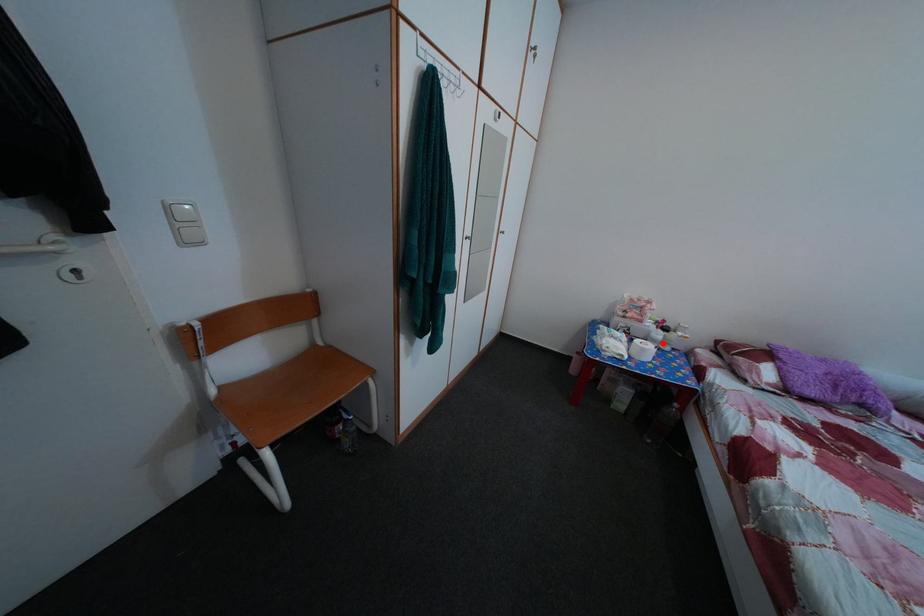
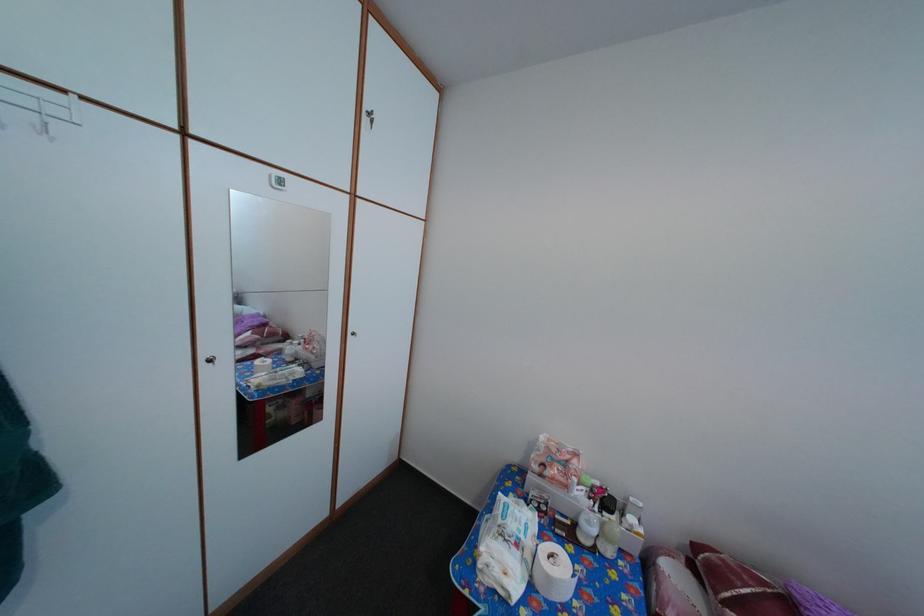
Find the pixel in the second image that matches the highlighted location in the first image.

(592, 531)